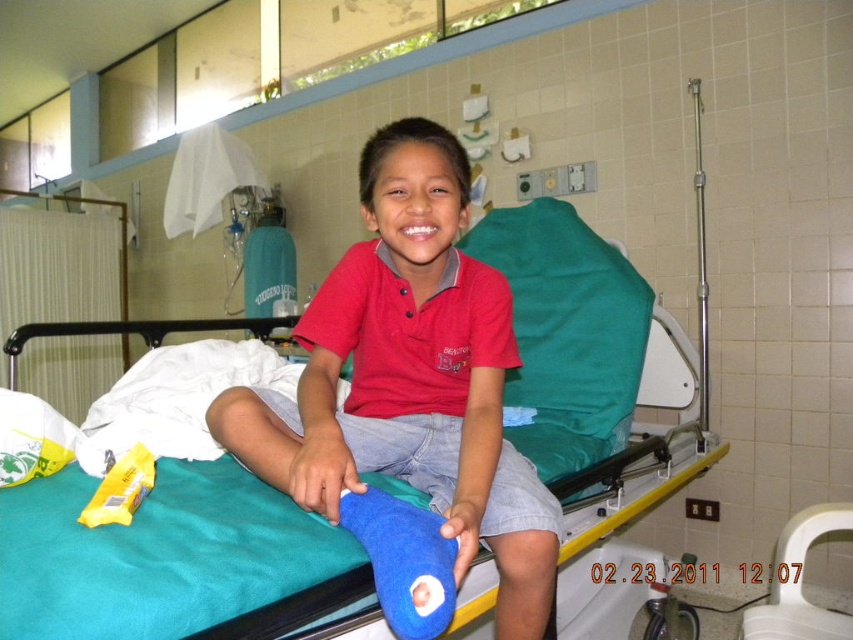
You are a nurse checking the distance between the teal fabric hospital bed at center and the red cotton shirt at center. According to the hospital guidelines, the minimum safe distance between medical equipment and patient clothing should be at least 18 inches to prevent contamination. Is the current distance compliant with the guidelines?

The teal fabric hospital bed at center is 17.33 inches away from the red cotton shirt at center, which is less than the required 18 inches. Therefore, the current distance does not comply with the hospital guidelines to prevent contamination.

You are a nurse checking the hospital bed. The teal fabric hospital bed at center and the red cotton shirt at center are in the room. Which one has a smaller height?

The teal fabric hospital bed at center has a lesser height compared to the red cotton shirt at center.